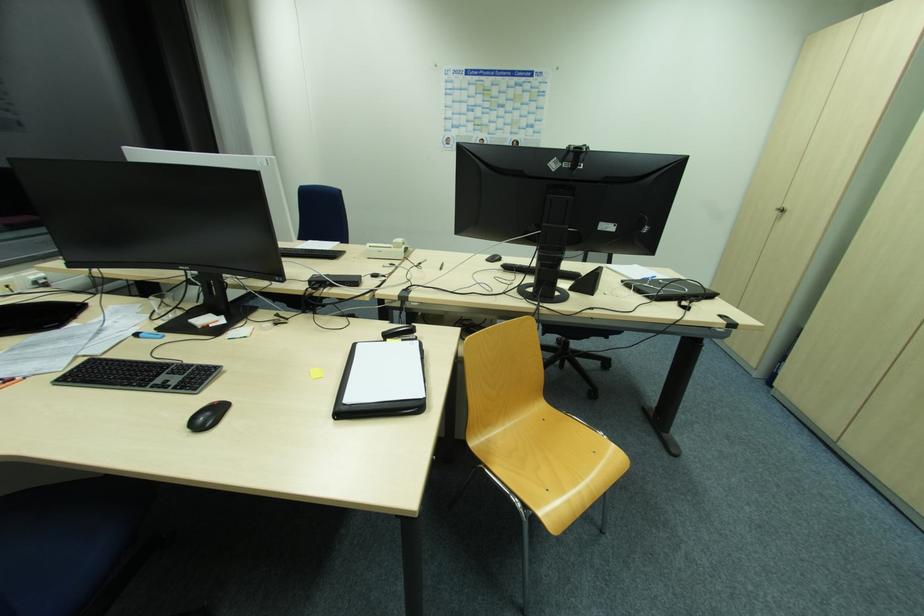
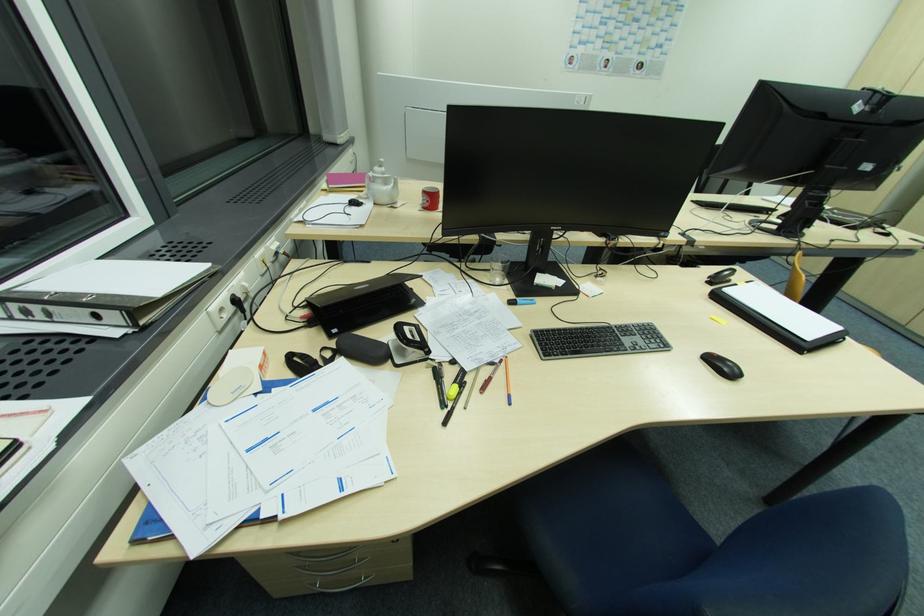
Question: The images are taken continuously from a first-person perspective. In which direction are you moving?

Choices:
 (A) Left
 (B) Right
 (C) Forward
 (D) Backward

Answer: (A)